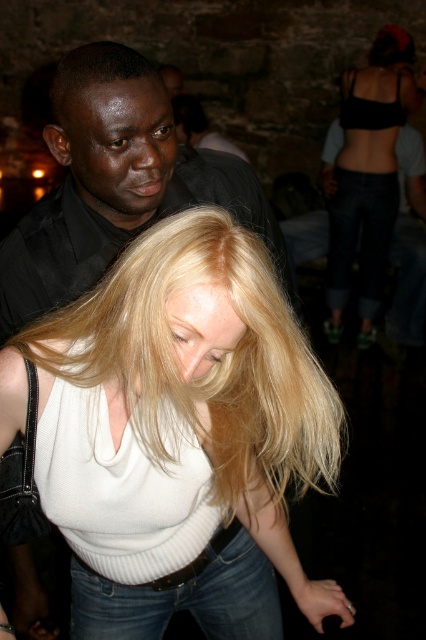
Question: Does black matte shirt at upper left appear on the right side of black matte tank top at upper right?

Choices:
 (A) no
 (B) yes

Answer: (A)

Question: Is white knitwear at center wider than shiny black hair at upper left?

Choices:
 (A) no
 (B) yes

Answer: (B)

Question: Which point is farther to the camera?

Choices:
 (A) [150, 634]
 (B) [83, 72]
 (C) [203, 237]

Answer: (A)

Question: Among these objects, which one is nearest to the camera?

Choices:
 (A) black matte tank top at upper right
 (B) denim jeans at lower center

Answer: (B)

Question: Where is black matte tank top at upper right located in relation to shiny black hair at upper left in the image?

Choices:
 (A) right
 (B) left

Answer: (A)

Question: Which object is the closest to the black matte tank top at upper right?

Choices:
 (A) shiny black hair at upper left
 (B) white knitwear at center

Answer: (B)